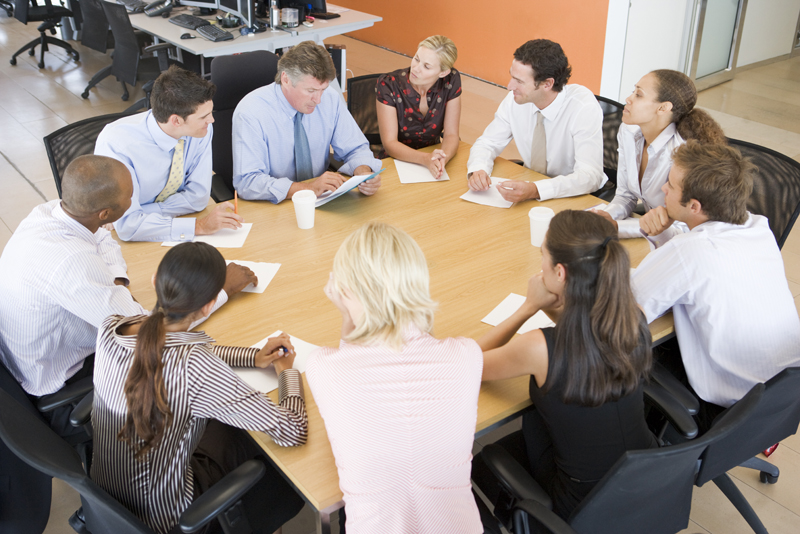
You are a GUI agent. You are given a task and a screenshot of the screen. Output one action in this format:
    pyautogui.click(x=<x>, y=<y>)
    Task: Click on the writing utensil
    
    Given the screenshot: What is the action you would take?
    pyautogui.click(x=496, y=185), pyautogui.click(x=433, y=159), pyautogui.click(x=234, y=198), pyautogui.click(x=284, y=353)